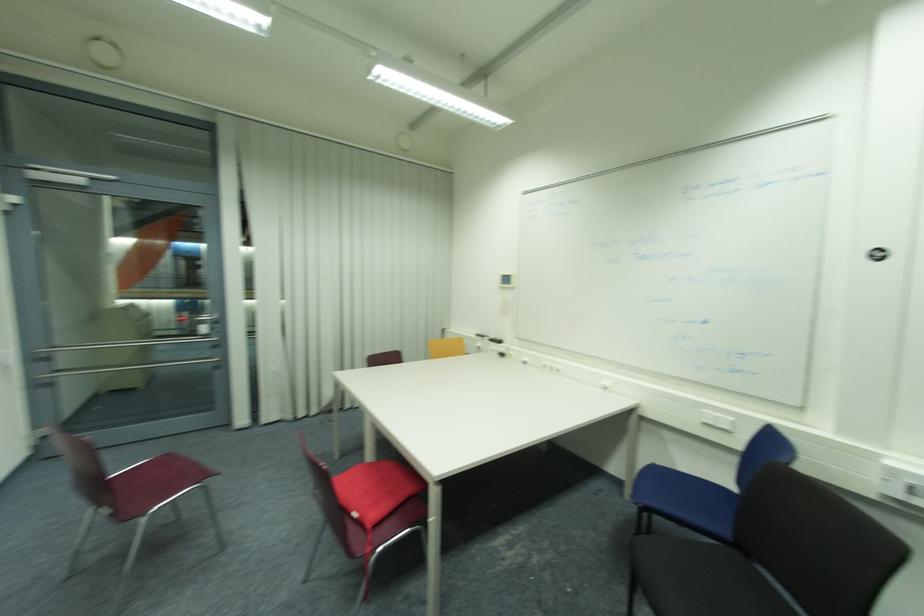
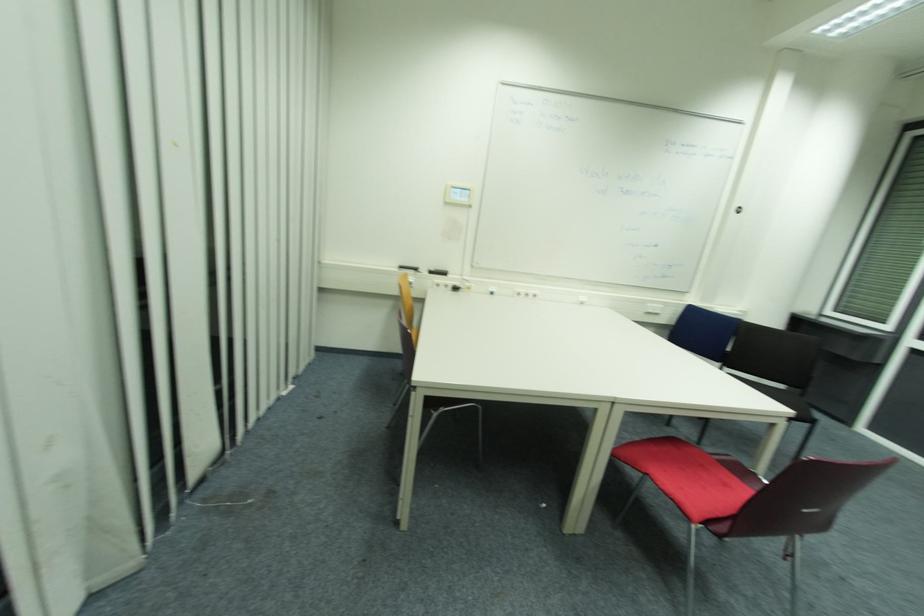
In the second image, find the point that corresponds to pixel 555 370 in the first image.

(529, 294)